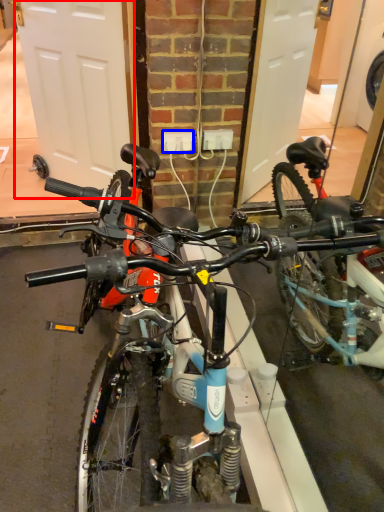
Question: Which object appears farthest to the camera in this image, garage door (highlighted by a red box) or power outlet (highlighted by a blue box)?

Choices:
 (A) garage door
 (B) power outlet

Answer: (B)